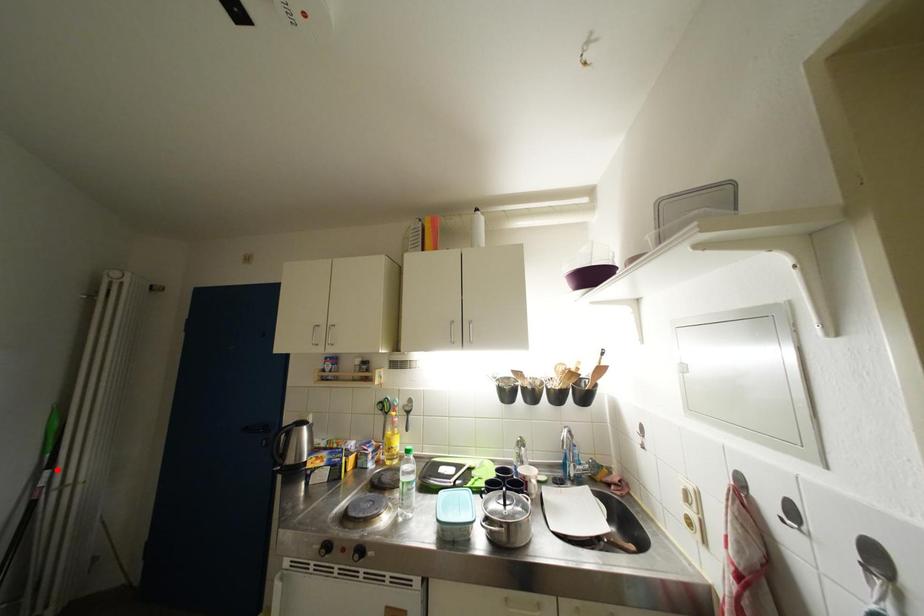
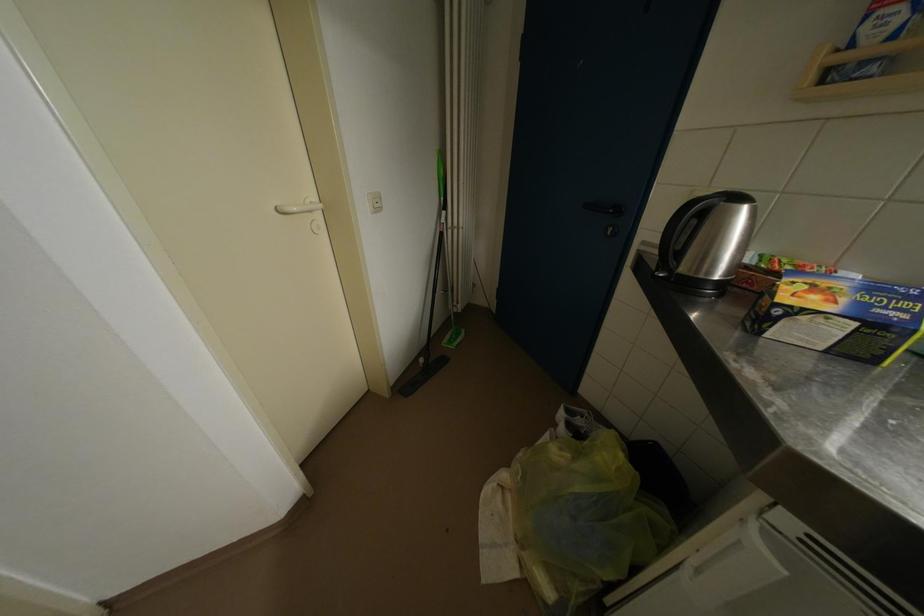
In the second image, find the point that corresponds to the highlighted location in the first image.

(451, 211)